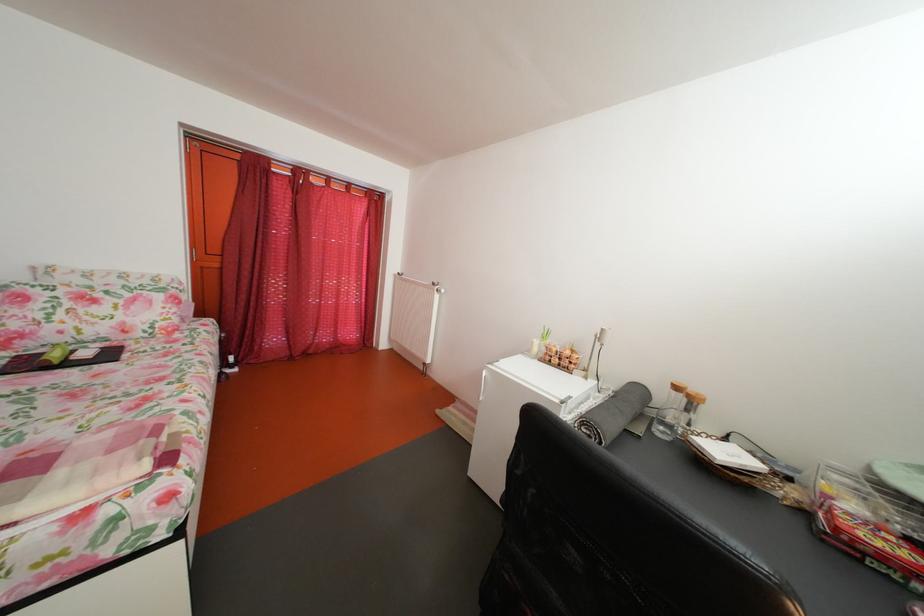
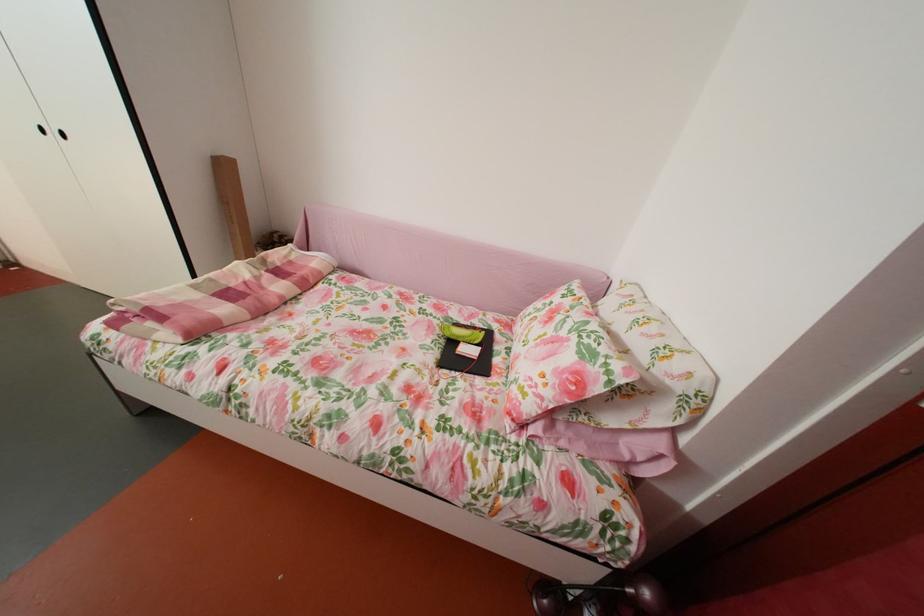
Where in the second image is the point corresponding to the point at 188,326 from the first image?

(541, 413)